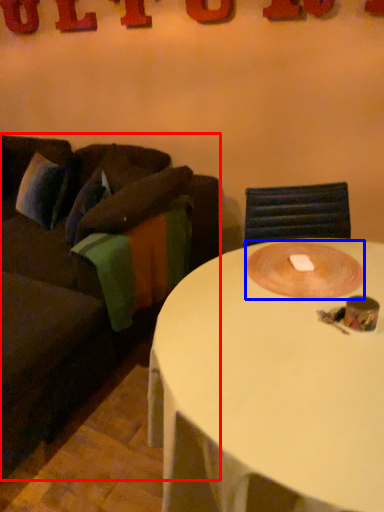
Question: Among these objects, which one is nearest to the camera, studio couch (highlighted by a red box) or oval (highlighted by a blue box)?

Choices:
 (A) studio couch
 (B) oval

Answer: (A)